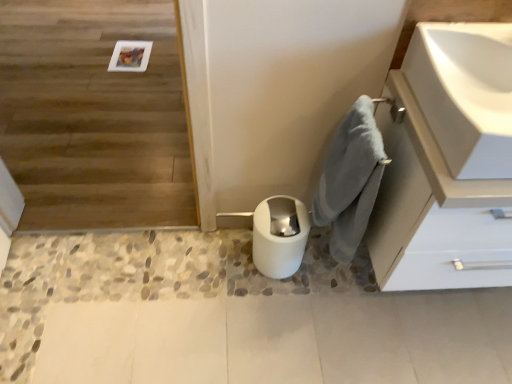
Question: Does point (265, 244) appear closer or farther from the camera than point (484, 74)?

Choices:
 (A) farther
 (B) closer

Answer: (A)

Question: Considering the relative positions of white glossy toilet bowl at lower center and white glossy sink at upper right in the image provided, is white glossy toilet bowl at lower center to the left or to the right of white glossy sink at upper right?

Choices:
 (A) left
 (B) right

Answer: (A)

Question: Considering the real-world distances, which object is farthest from the wooden floor at upper left?

Choices:
 (A) gray fluffy bath towel at lower right
 (B) white glossy toilet bowl at lower center
 (C) white matte cabinet at upper right
 (D) white glossy sink at upper right

Answer: (D)

Question: Considering the real-world distances, which object is closest to the gray fluffy bath towel at lower right?

Choices:
 (A) wooden floor at upper left
 (B) white glossy sink at upper right
 (C) white glossy toilet bowl at lower center
 (D) white matte cabinet at upper right

Answer: (D)